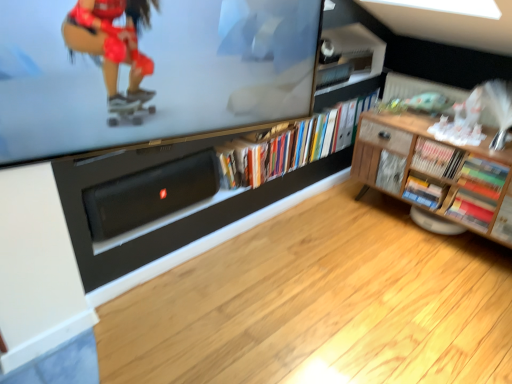
Question: Is multicolored paper book at lower right, acting as the second book starting from the right, looking in the opposite direction of wooden cabinet at right?

Choices:
 (A) no
 (B) yes

Answer: (B)

Question: Does multicolored paper book at lower right, which is counted as the fourth book, starting from the left, come in front of wooden cabinet at right?

Choices:
 (A) no
 (B) yes

Answer: (A)

Question: From a real-world perspective, is multicolored paper book at lower right, acting as the second book starting from the right, physically above wooden cabinet at right?

Choices:
 (A) no
 (B) yes

Answer: (A)

Question: Does multicolored paper book at lower right, acting as the second book starting from the right, have a greater height compared to wooden cabinet at right?

Choices:
 (A) no
 (B) yes

Answer: (A)

Question: Does multicolored paper book at lower right, which is counted as the fourth book, starting from the left, appear on the left side of wooden cabinet at right?

Choices:
 (A) no
 (B) yes

Answer: (B)

Question: Could you tell me if multicolored paper book at lower right, acting as the second book starting from the right, is turned towards wooden cabinet at right?

Choices:
 (A) no
 (B) yes

Answer: (B)

Question: Is wooden cabinet at right not within black matte speaker at lower center?

Choices:
 (A) yes
 (B) no

Answer: (A)

Question: From the image's perspective, is wooden cabinet at right over black matte speaker at lower center?

Choices:
 (A) yes
 (B) no

Answer: (A)

Question: Considering the relative sizes of wooden cabinet at right and black matte speaker at lower center in the image provided, is wooden cabinet at right thinner than black matte speaker at lower center?

Choices:
 (A) yes
 (B) no

Answer: (B)

Question: From a real-world perspective, is wooden cabinet at right below black matte speaker at lower center?

Choices:
 (A) no
 (B) yes

Answer: (B)

Question: Is wooden cabinet at right turned away from black matte speaker at lower center?

Choices:
 (A) no
 (B) yes

Answer: (A)

Question: Are wooden cabinet at right and black matte speaker at lower center far apart?

Choices:
 (A) no
 (B) yes

Answer: (B)

Question: Can you confirm if matte black television at upper center is wider than wooden bookshelf at right, the third book when ordered from left to right?

Choices:
 (A) yes
 (B) no

Answer: (B)